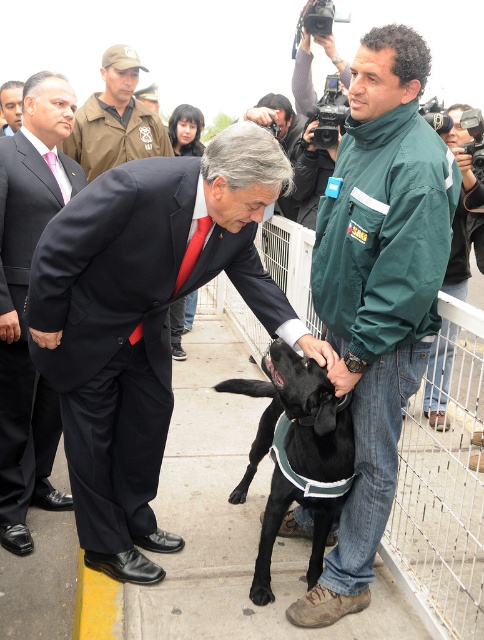
Question: Which object is the farthest from the black matte dog at center?

Choices:
 (A) matte black suit at left
 (B) matte black suit at center
 (C) camouflage uniform at upper left

Answer: (C)

Question: Which object is the farthest from the green fabric jacket at upper right?

Choices:
 (A) matte black suit at left
 (B) matte black suit at center
 (C) black matte dog at center

Answer: (A)

Question: From the image, what is the correct spatial relationship of matte black suit at center in relation to matte black suit at left?

Choices:
 (A) right
 (B) left

Answer: (A)

Question: Which of the following is the closest to the observer?

Choices:
 (A) 16,288
 (B) 346,444

Answer: (B)

Question: Observing the image, what is the correct spatial positioning of matte black suit at center in reference to camouflage uniform at upper left?

Choices:
 (A) right
 (B) left

Answer: (A)

Question: Does black matte dog at center appear under camouflage uniform at upper left?

Choices:
 (A) no
 (B) yes

Answer: (B)